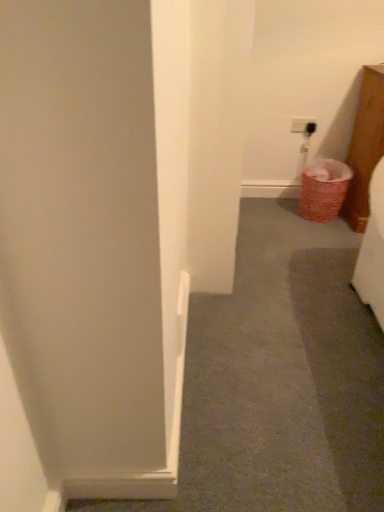
Question: Considering the positions of white smooth door at center and woven brown laundry basket at lower right in the image, is white smooth door at center wider or thinner than woven brown laundry basket at lower right?

Choices:
 (A) wide
 (B) thin

Answer: (A)

Question: Considering their positions, is white smooth door at center located in front of or behind woven brown laundry basket at lower right?

Choices:
 (A) behind
 (B) front

Answer: (B)

Question: From a real-world perspective, relative to woven brown laundry basket at lower right, is white smooth door at center vertically above or below?

Choices:
 (A) above
 (B) below

Answer: (B)

Question: Is woven brown laundry basket at lower right inside or outside of white smooth door at center?

Choices:
 (A) outside
 (B) inside

Answer: (A)

Question: From their relative heights in the image, would you say woven brown laundry basket at lower right is taller or shorter than white smooth door at center?

Choices:
 (A) tall
 (B) short

Answer: (A)

Question: Considering the relative positions of woven brown laundry basket at lower right and white smooth door at center in the image provided, is woven brown laundry basket at lower right to the left or to the right of white smooth door at center?

Choices:
 (A) left
 (B) right

Answer: (B)

Question: Considering their positions, is woven brown laundry basket at lower right located in front of or behind white smooth door at center?

Choices:
 (A) front
 (B) behind

Answer: (B)